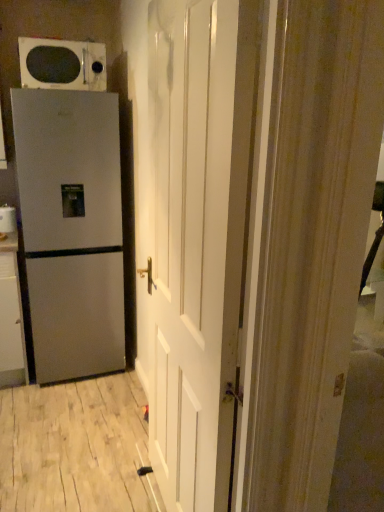
Question: Considering the relative sizes of white glossy cabinet at left and white glossy door at center in the image provided, is white glossy cabinet at left bigger than white glossy door at center?

Choices:
 (A) yes
 (B) no

Answer: (B)

Question: From the image's perspective, would you say white glossy cabinet at left is positioned over white glossy door at center?

Choices:
 (A) no
 (B) yes

Answer: (A)

Question: Is white glossy cabinet at left in contact with white glossy door at center?

Choices:
 (A) yes
 (B) no

Answer: (B)

Question: From the image's perspective, would you say white glossy cabinet at left is shown under white glossy door at center?

Choices:
 (A) yes
 (B) no

Answer: (A)

Question: Is the depth of white glossy cabinet at left greater than that of white glossy door at center?

Choices:
 (A) yes
 (B) no

Answer: (A)

Question: In the image, is satin silver refrigerator at left positioned in front of or behind white glossy door at center?

Choices:
 (A) behind
 (B) front

Answer: (A)

Question: Based on their positions, is satin silver refrigerator at left located to the left or right of white glossy door at center?

Choices:
 (A) right
 (B) left

Answer: (B)

Question: Is satin silver refrigerator at left bigger or smaller than white glossy door at center?

Choices:
 (A) big
 (B) small

Answer: (A)

Question: Which is correct: satin silver refrigerator at left is inside white glossy door at center, or outside of it?

Choices:
 (A) inside
 (B) outside

Answer: (B)

Question: Choose the correct answer: Is white glossy door at center inside satin silver refrigerator at left or outside it?

Choices:
 (A) inside
 (B) outside

Answer: (B)

Question: Considering their positions, is white glossy door at center located in front of or behind satin silver refrigerator at left?

Choices:
 (A) behind
 (B) front

Answer: (B)

Question: Considering the positions of point (198, 462) and point (61, 285), is point (198, 462) closer or farther from the camera than point (61, 285)?

Choices:
 (A) farther
 (B) closer

Answer: (B)

Question: Considering the positions of white glossy door at center and satin silver refrigerator at left in the image, is white glossy door at center wider or thinner than satin silver refrigerator at left?

Choices:
 (A) thin
 (B) wide

Answer: (A)

Question: Is point (6, 270) closer or farther from the camera than point (44, 296)?

Choices:
 (A) farther
 (B) closer

Answer: (B)

Question: In the image, is white glossy cabinet at left on the left side or the right side of satin silver refrigerator at left?

Choices:
 (A) right
 (B) left

Answer: (B)